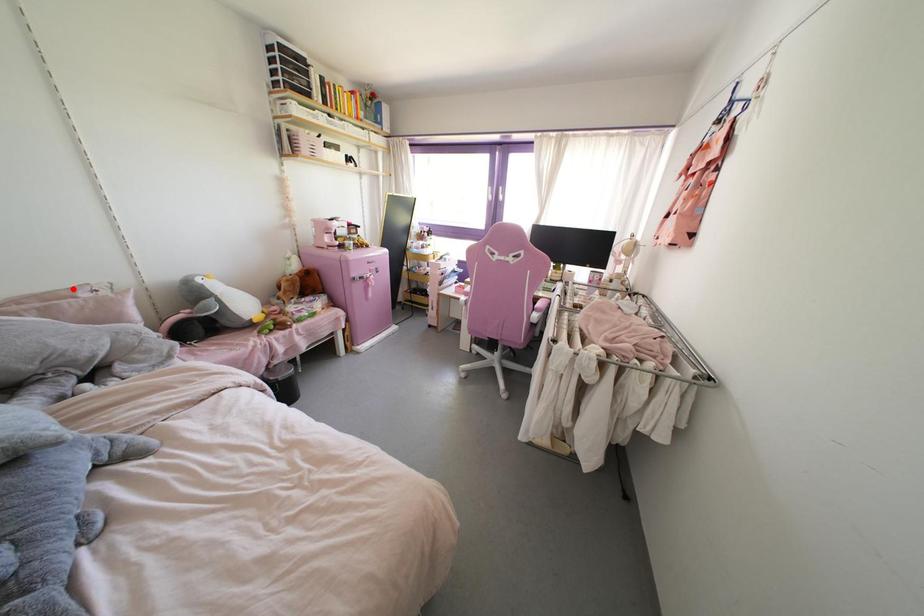
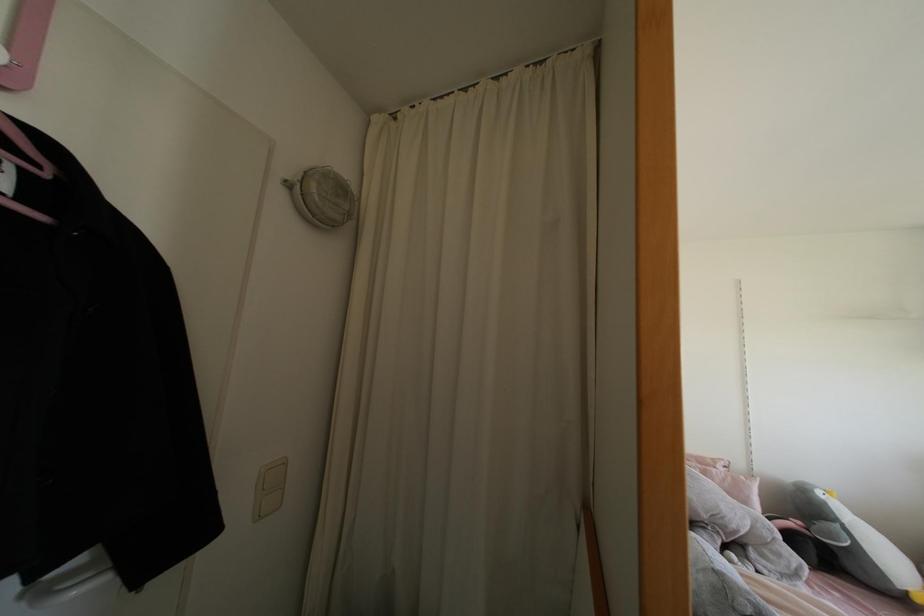
The point at the highlighted location is marked in the first image. Where is the corresponding point in the second image?

(712, 460)